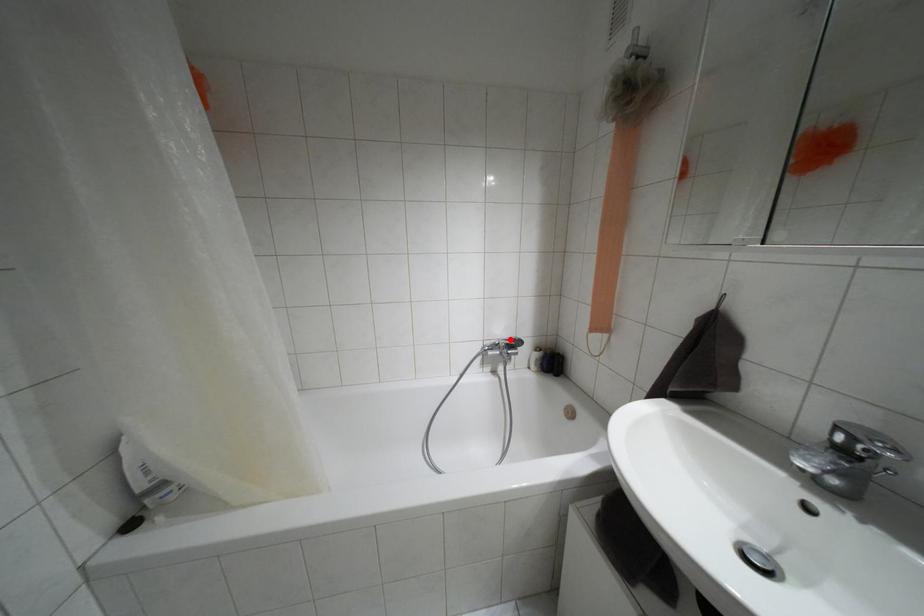
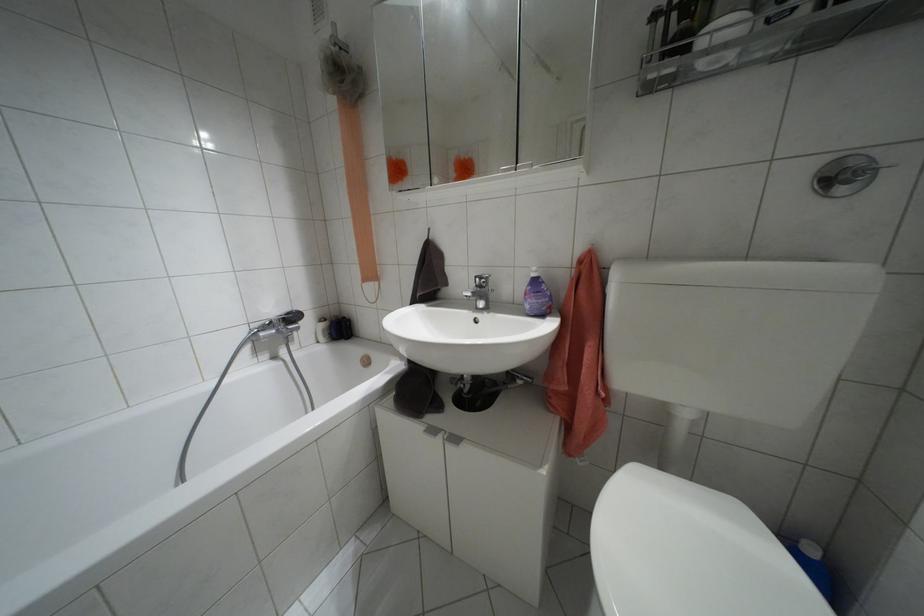
Question: I am providing you with two images of the same scene from different viewpoints. A red point is shown in image1. For the corresponding object point in image2, is it positioned nearer or farther from the camera?

Choices:
 (A) Nearer
 (B) Farther

Answer: (A)